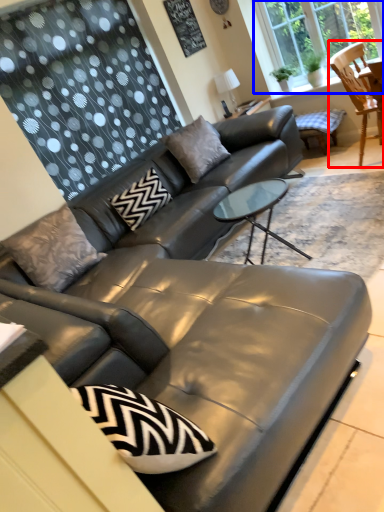
Question: Which of the following is the farthest to the observer, chair (highlighted by a red box) or window (highlighted by a blue box)?

Choices:
 (A) chair
 (B) window

Answer: (B)